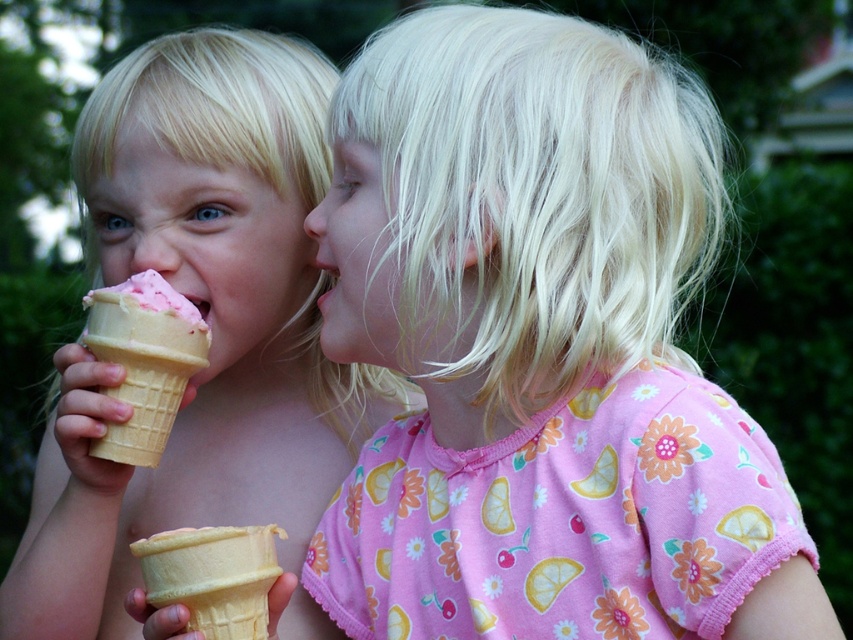
Is blonde hair at center shorter than vanilla waffle cone at lower left?

In fact, blonde hair at center may be taller than vanilla waffle cone at lower left.

Does blonde hair at center appear under vanilla waffle cone at lower left?

Actually, blonde hair at center is above vanilla waffle cone at lower left.

Identify the location of blonde hair at center. (380, 275).

I want to click on blonde hair at center, so tap(380, 275).

Is point (408, 285) positioned after point (149, 336)?

No, it is not.

Identify the location of blonde hair at center. The width and height of the screenshot is (853, 640). (380, 275).

Between point (251, 289) and point (131, 317), which one is positioned in front?

Point (131, 317)

Is pink matte ice cream cone at left closer to the viewer compared to pink soft serve ice cream at left?

That is False.

Is point (234, 298) positioned before point (173, 310)?

No, (234, 298) is behind (173, 310).

You are a GUI agent. You are given a task and a screenshot of the screen. Output one action in this format:
    pyautogui.click(x=<x>, y=<y>)
    Task: Click on the pink matte ice cream cone at left
    This screenshot has width=853, height=640.
    Given the screenshot: What is the action you would take?
    pyautogui.click(x=207, y=250)